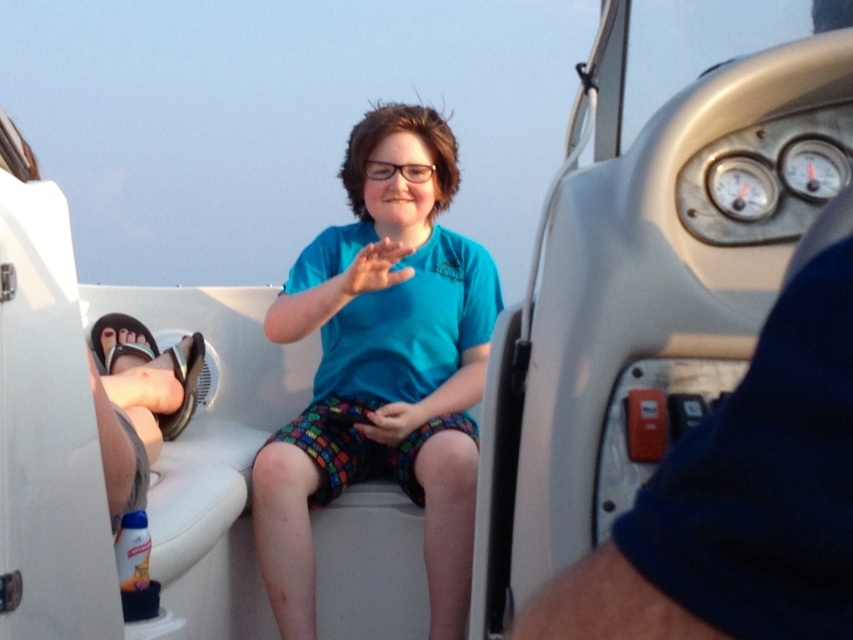
Question: Which object appears closest to the camera in this image?

Choices:
 (A) blue fabric shirt at center
 (B) matte blue shirt at center

Answer: (A)

Question: From the image, what is the correct spatial relationship of blue fabric shirt at center in relation to matte blue shirt at center?

Choices:
 (A) left
 (B) right

Answer: (B)

Question: Is teal fabric shirt at center thinner than matte blue shirt at center?

Choices:
 (A) no
 (B) yes

Answer: (A)

Question: Considering the real-world distances, which object is farthest from the blue fabric shirt at center?

Choices:
 (A) multicolored fabric hand at center
 (B) matte blue shirt at center
 (C) teal fabric shirt at center

Answer: (A)

Question: Is matte blue shirt at center positioned before multicolored fabric hand at center?

Choices:
 (A) yes
 (B) no

Answer: (A)

Question: Which point is farther to the camera?

Choices:
 (A) (399, 440)
 (B) (689, 602)

Answer: (A)